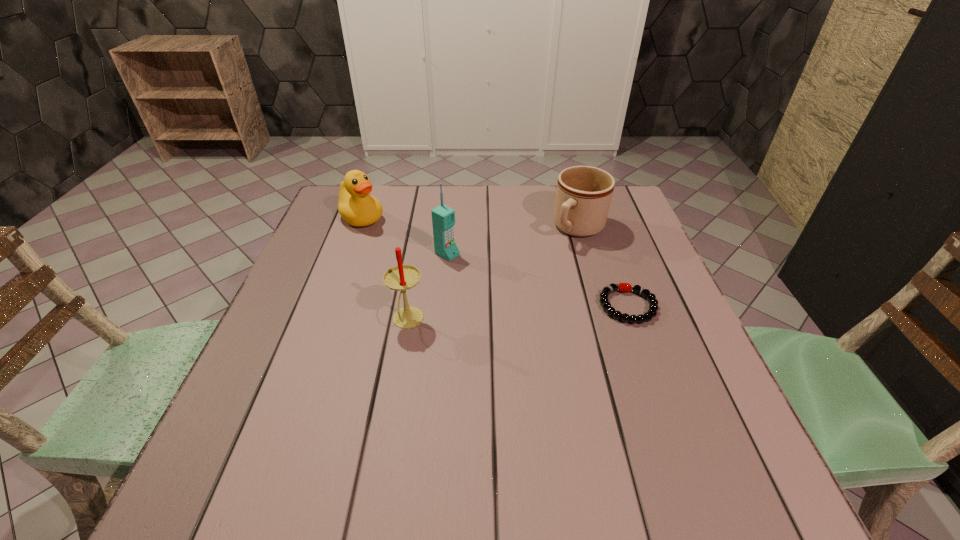
Image resolution: width=960 pixels, height=540 pixels. Identify the location of vacant point that satisfies the following two spatial constraints: 1. on the front side of the leftmost object; 2. on the right side of the mug. (358, 228).

What are the coordinates of `free spot that satisfies the following two spatial constraints: 1. on the front side of the leftmost object; 2. on the right side of the mug` in the screenshot? It's located at (358, 228).

At what (x,y) coordinates should I click in order to perform the action: click on vacant area in the image that satisfies the following two spatial constraints: 1. on the back side of the candle; 2. on the right side of the bracelet. Please return your answer as a coordinate pair (x, y). Looking at the image, I should click on (410, 306).